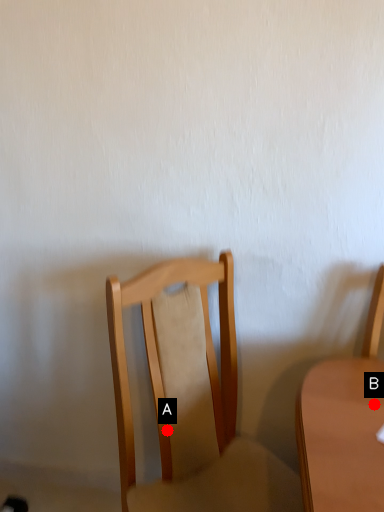
Question: Two points are circled on the image, labeled by A and B beside each circle. Which of the following is the farthest from the observer?

Choices:
 (A) A is further
 (B) B is further

Answer: (A)